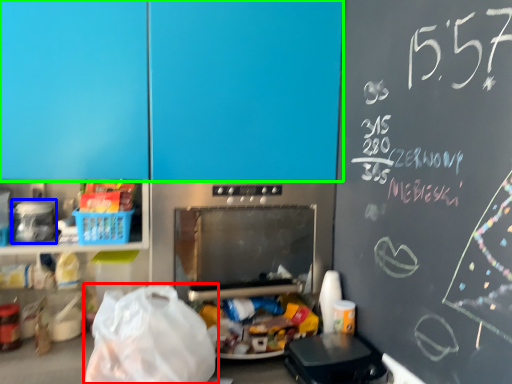
Question: Which is nearer to the grocery bag (highlighted by a red box)? appliance (highlighted by a blue box) or leftover (highlighted by a green box).

Choices:
 (A) appliance
 (B) leftover

Answer: (A)